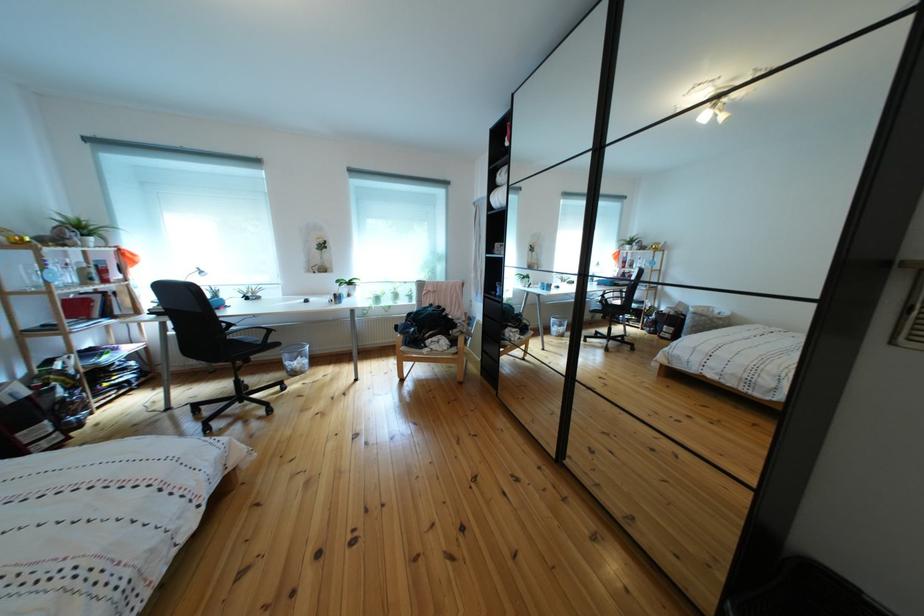
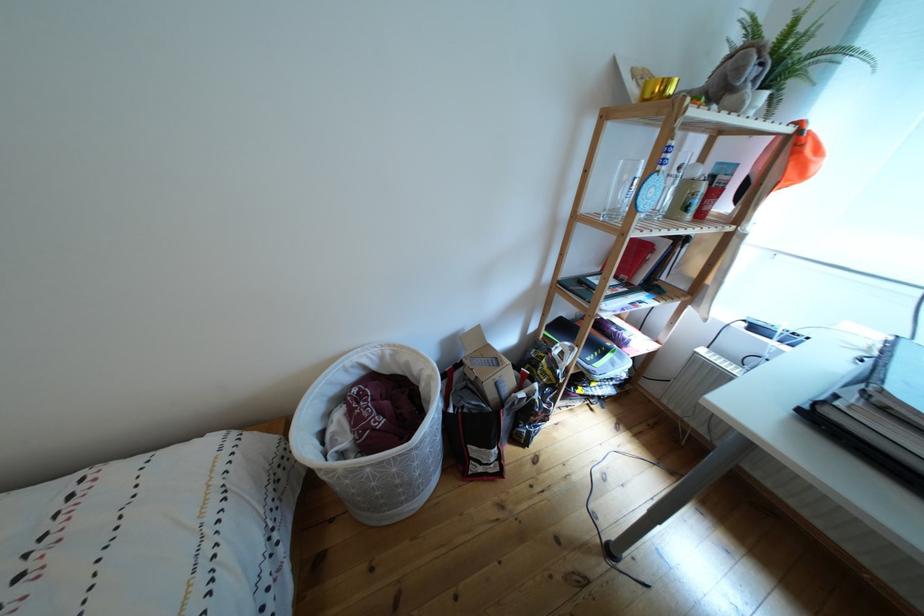
In the second image, find the point that corresponds to [79,240] in the first image.

(762, 77)